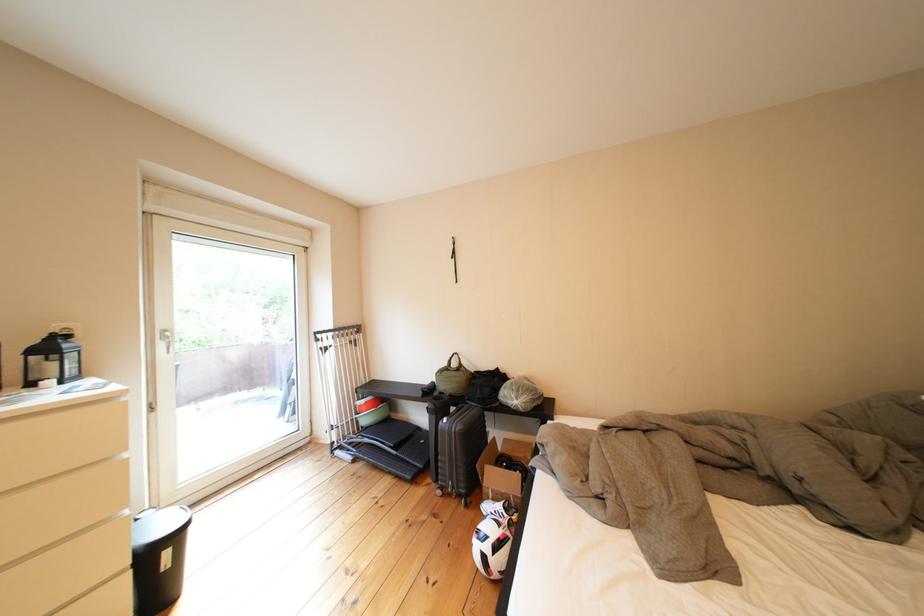
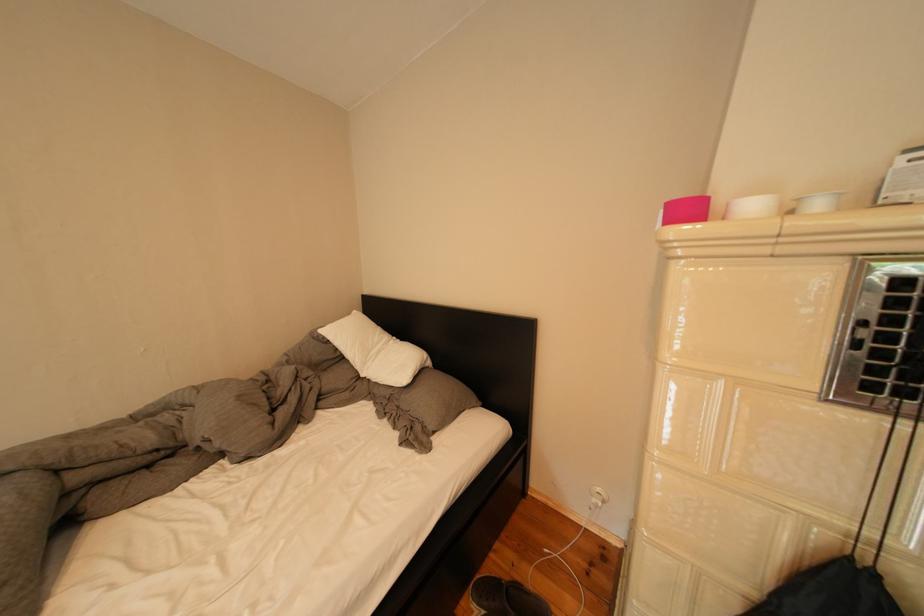
Question: The camera is either moving clockwise (left) or counter-clockwise (right) around the object. The first image is from the beginning of the video and the second image is from the end. Is the camera moving left or right when shooting the video?

Choices:
 (A) Left
 (B) Right

Answer: (A)